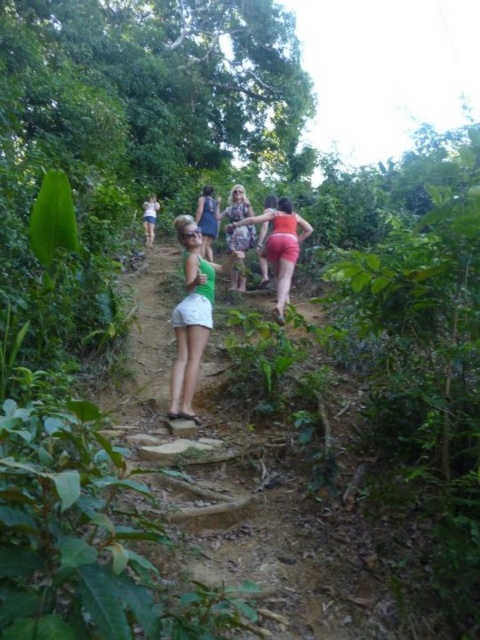
From the picture: You are standing at the point labeled point [155,209] and want to move to the point labeled point [276,259]. Given that the path is narrow and uneven, can you safely walk towards the other point without needing to backtrack?

Yes, you can safely walk towards point [276,259] from point [155,209] because point [276,259] is closer to the viewer, meaning it is on a more accessible path forward.

You are standing at the point labeled point (144, 218) and want to walk to the point labeled point (182, 413). Given the path is narrow and uneven, will you have to walk uphill or downhill?

Since point (182, 413) is closer to the camera than point (144, 218), you will have to walk uphill to reach it from your current position.